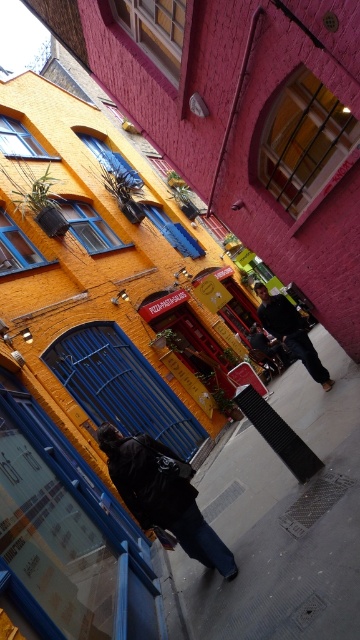
You are standing in the alleyway between the yellow and pink buildings. You see the concrete sidewalk at center and the dark blue jeans at center. Which object is closer to you?

The concrete sidewalk at center is closer to you because it is in front of the dark blue jeans at center.